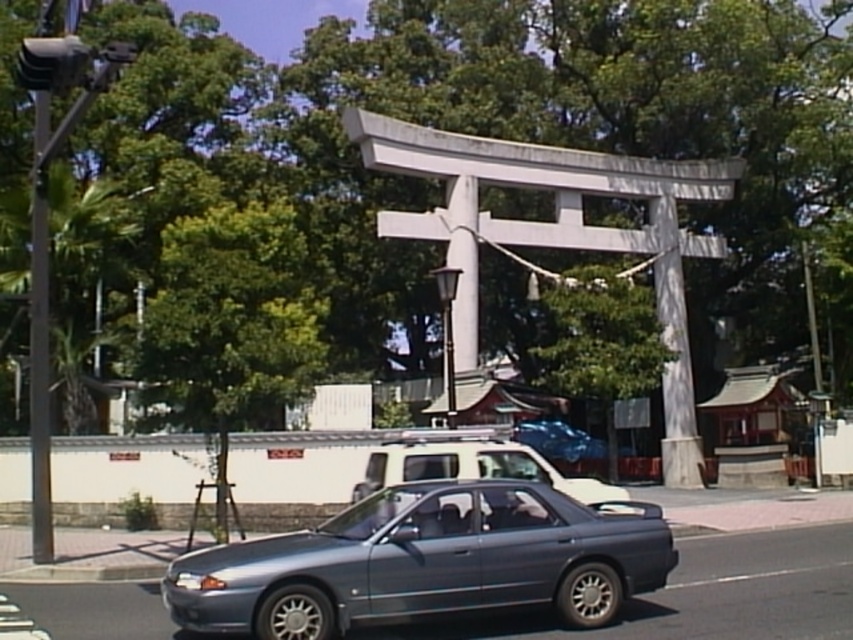
Consider the image. Who is more distant from viewer, (607, 595) or (468, 468)?

The point (468, 468) is behind.

Which is above, satin metallic sedan at center or metallic silver suv at center?

Positioned higher is metallic silver suv at center.

Which is in front, point (583, 518) or point (393, 468)?

Point (583, 518) is in front.

Image resolution: width=853 pixels, height=640 pixels. Identify the location of satin metallic sedan at center. (427, 561).